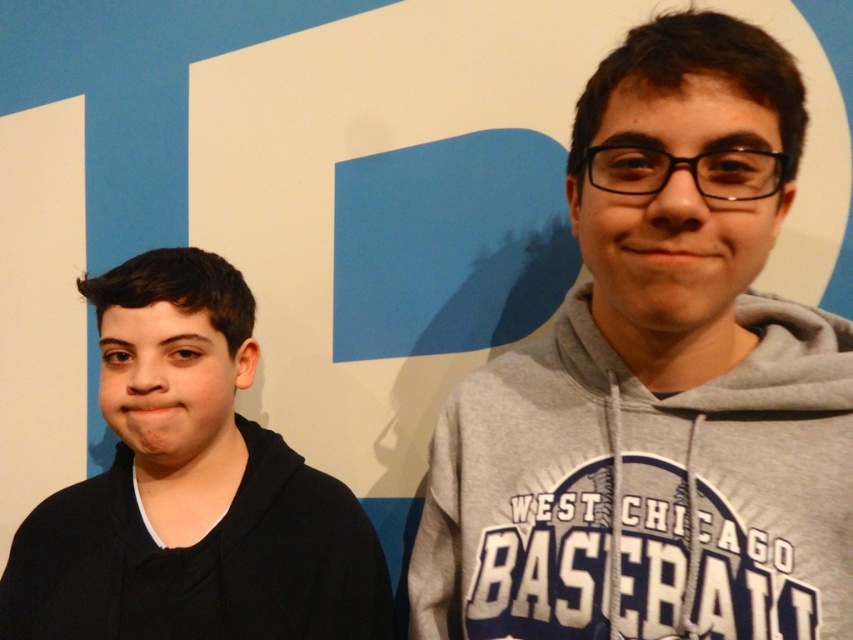
Question: Can you confirm if gray hoodie at center is thinner than black matte hoodie at left?

Choices:
 (A) yes
 (B) no

Answer: (A)

Question: Is gray hoodie at center below black matte hoodie at left?

Choices:
 (A) no
 (B) yes

Answer: (A)

Question: Is gray hoodie at center to the left of black matte hoodie at left from the viewer's perspective?

Choices:
 (A) no
 (B) yes

Answer: (A)